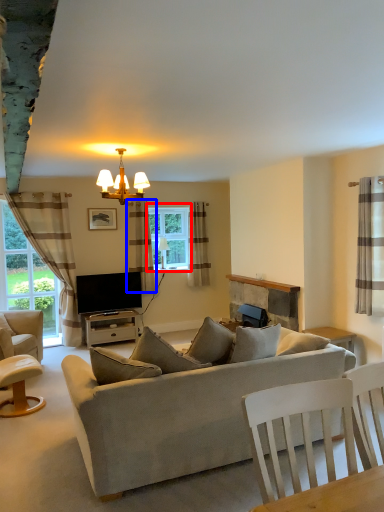
Question: Which point is further to the camera, window (highlighted by a red box) or curtain (highlighted by a blue box)?

Choices:
 (A) window
 (B) curtain

Answer: (A)